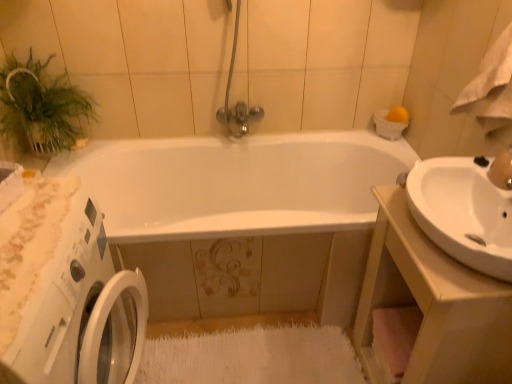
Question: Considering the relative sizes of white glossy sink at right and green leafy plant at upper left in the image provided, is white glossy sink at right wider than green leafy plant at upper left?

Choices:
 (A) yes
 (B) no

Answer: (A)

Question: From a real-world perspective, is white glossy sink at right located beneath green leafy plant at upper left?

Choices:
 (A) no
 (B) yes

Answer: (B)

Question: Can you confirm if white glossy sink at right is shorter than green leafy plant at upper left?

Choices:
 (A) yes
 (B) no

Answer: (B)

Question: Does white glossy sink at right have a smaller size compared to green leafy plant at upper left?

Choices:
 (A) yes
 (B) no

Answer: (B)

Question: Is white glossy sink at right not close to green leafy plant at upper left?

Choices:
 (A) no
 (B) yes

Answer: (B)

Question: From a real-world perspective, relative to matte gold faucet at upper right, is white glossy sink at right vertically above or below?

Choices:
 (A) below
 (B) above

Answer: (A)

Question: Considering the positions of white glossy sink at right and matte gold faucet at upper right in the image, is white glossy sink at right bigger or smaller than matte gold faucet at upper right?

Choices:
 (A) big
 (B) small

Answer: (A)

Question: In terms of width, does white glossy sink at right look wider or thinner when compared to matte gold faucet at upper right?

Choices:
 (A) thin
 (B) wide

Answer: (B)

Question: From their relative heights in the image, would you say white glossy sink at right is taller or shorter than matte gold faucet at upper right?

Choices:
 (A) tall
 (B) short

Answer: (B)

Question: Is white glossy sink at right situated inside green leafy plant at upper left or outside?

Choices:
 (A) inside
 (B) outside

Answer: (B)

Question: Is white glossy sink at right wider or thinner than green leafy plant at upper left?

Choices:
 (A) thin
 (B) wide

Answer: (B)

Question: Does point (466, 165) appear closer or farther from the camera than point (39, 129)?

Choices:
 (A) farther
 (B) closer

Answer: (B)

Question: From a real-world perspective, relative to green leafy plant at upper left, is white glossy sink at right vertically above or below?

Choices:
 (A) below
 (B) above

Answer: (B)

Question: Based on their positions, is green leafy plant at upper left located to the left or right of white glossy sink at right?

Choices:
 (A) left
 (B) right

Answer: (A)

Question: From the image's perspective, is green leafy plant at upper left above or below white glossy sink at right?

Choices:
 (A) above
 (B) below

Answer: (A)